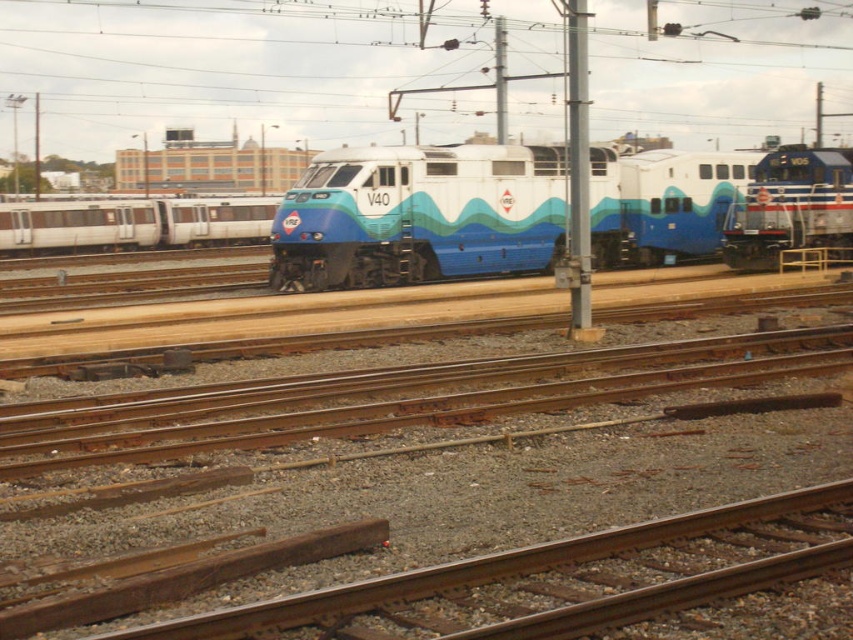
You are a railway inspector checking the spacing between two trains in the yard. You see the matte blue train at center and the blue glossy locomotive at right. Based on their widths, which one requires more space between them for safe maintenance access?

The matte blue train at center requires more space between them for safe maintenance access because its width is larger than the blue glossy locomotive at right.

You are a railway inspector checking the alignment of tracks and trains. You notice the rusty metal track at center and the matte blue train at center. Which object is positioned to the left?

The rusty metal track at center is to the left of the matte blue train at center, so the rusty metal track at center is positioned to the left.

You are a railway inspector checking the tracks. You notice the rusty metal track at center and the matte blue train at center. Which object is positioned lower in the image?

The rusty metal track at center is located below the matte blue train at center, so it is positioned lower in the image.